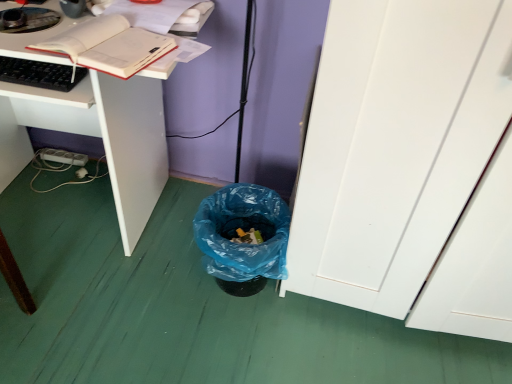
Identify the location of free space in front of blue plastic trash can at lower center. The width and height of the screenshot is (512, 384). (225, 345).